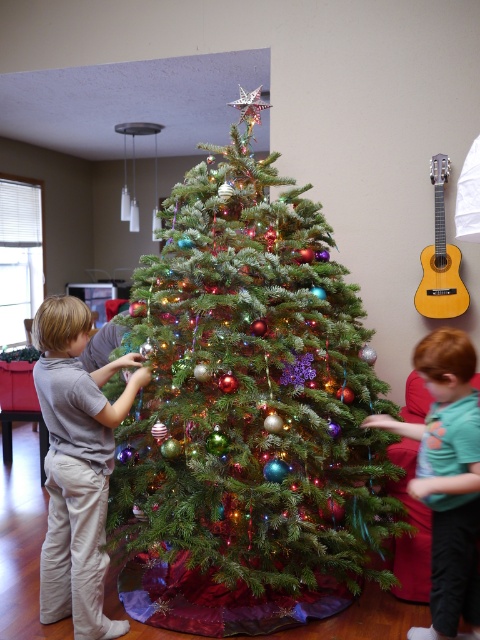
Question: Is gray cotton shirt at left positioned in front of green cotton shirt at right?

Choices:
 (A) no
 (B) yes

Answer: (A)

Question: Can you confirm if green cotton shirt at right is positioned below yellow wood guitar at upper right?

Choices:
 (A) no
 (B) yes

Answer: (B)

Question: Which of the following is the closest to the observer?

Choices:
 (A) yellow wood guitar at upper right
 (B) gray cotton shirt at left

Answer: (B)

Question: Does green matte christmas tree at center appear under gray cotton shirt at left?

Choices:
 (A) no
 (B) yes

Answer: (A)

Question: Which object appears closest to the camera in this image?

Choices:
 (A) green cotton shirt at right
 (B) green matte christmas tree at center
 (C) yellow wood guitar at upper right

Answer: (A)

Question: Which point is closer to the camera?

Choices:
 (A) gray cotton shirt at left
 (B) green cotton shirt at right
 (C) green matte christmas tree at center

Answer: (B)